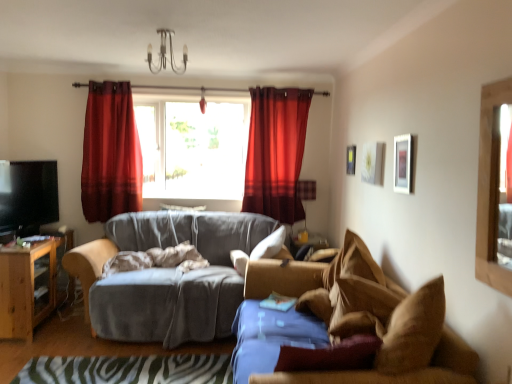
Question: Relative to zebra print rug at lower center, is velvet red curtain at upper center, the first curtain viewed from the left, in front or behind?

Choices:
 (A) front
 (B) behind

Answer: (B)

Question: Is velvet red curtain at upper center, the first curtain viewed from the left, inside or outside of zebra print rug at lower center?

Choices:
 (A) inside
 (B) outside

Answer: (B)

Question: Considering the real-world distances, which object is closest to the matte silver picture frame at upper right, arranged as the 1th picture frame when viewed from the front?

Choices:
 (A) matte red curtain at center, arranged as the second curtain when viewed from the left
 (B) white soft pillow at center
 (C) brown fabric couch at right, which appears as the second studio couch when viewed from the back
 (D) metallic chandelier at upper center
 (E) beige soft blanket at center

Answer: (C)

Question: Which object is the closest to the wooden cabinet at left?

Choices:
 (A) white soft pillow at center
 (B) white matte picture frame at upper center, which is the 2th picture frame from back to front
 (C) black glossy tv at left
 (D) matte black lampshade at center
 (E) matte silver picture frame at upper right, which is the third picture frame from back to front

Answer: (C)